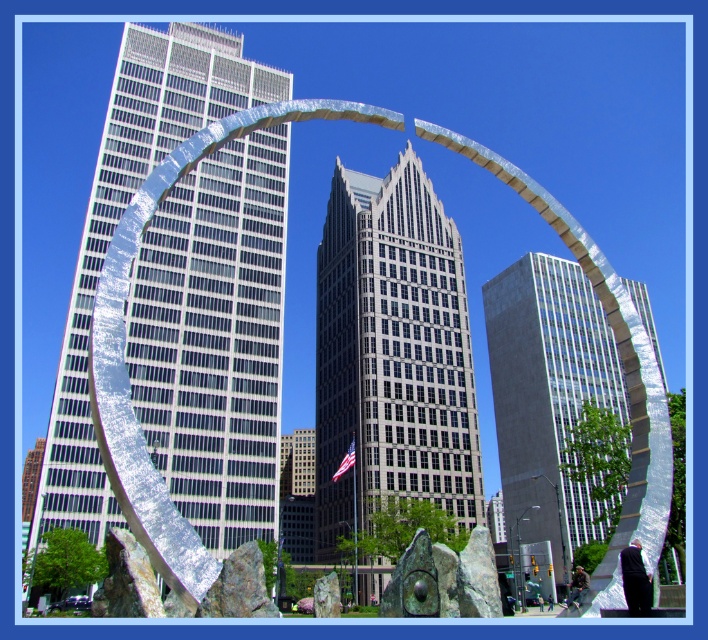
Which is more to the right, dark gray glass skyscraper at center or gray concrete skyscraper at center?

Positioned to the right is gray concrete skyscraper at center.

Is point (399, 424) farther from viewer compared to point (624, 401)?

That is False.

Where is `dark gray glass skyscraper at center`? dark gray glass skyscraper at center is located at coordinates (392, 355).

Can you confirm if silver metallic sculpture at center is bigger than gray concrete skyscraper at center?

Incorrect, silver metallic sculpture at center is not larger than gray concrete skyscraper at center.

Between point (159, 408) and point (576, 369), which one is positioned in front?

Point (159, 408)

The height and width of the screenshot is (640, 708). I want to click on silver metallic sculpture at center, so click(x=215, y=339).

Who is positioned more to the right, silver metallic sculpture at center or dark gray glass skyscraper at center?

From the viewer's perspective, dark gray glass skyscraper at center appears more on the right side.

Which is above, silver metallic sculpture at center or dark gray glass skyscraper at center?

silver metallic sculpture at center

Is point (234, 346) positioned behind point (459, 388)?

No.

Find the location of `silver metallic sculpture at center`. silver metallic sculpture at center is located at coordinates (215, 339).